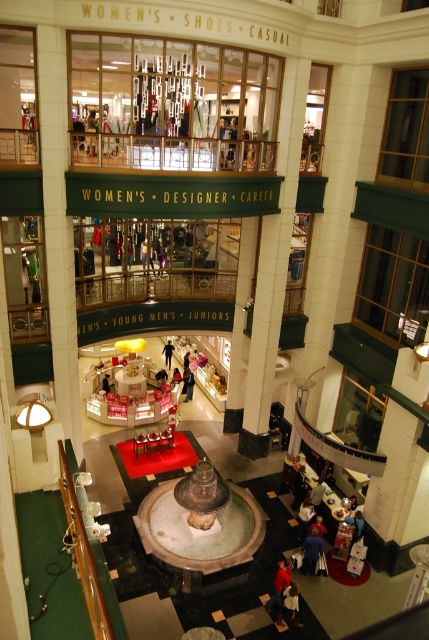
Is dark blue jeans at center in front of white fabric person at center?

No, dark blue jeans at center is further to the viewer.

Who is positioned more to the right, dark blue jeans at center or white fabric person at center?

Positioned to the right is dark blue jeans at center.

Who is more forward, (x=165, y=348) or (x=102, y=384)?

Point (x=102, y=384)

Locate an element on the screen. dark blue jeans at center is located at coordinates (168, 353).

Which is in front, point (308, 570) or point (105, 385)?

Point (308, 570)

Is dark blue jeans at lower right above white fabric person at center?

Incorrect, dark blue jeans at lower right is not positioned above white fabric person at center.

Is point (305, 538) farther from viewer compared to point (109, 387)?

No, (305, 538) is in front of (109, 387).

You are a GUI agent. You are given a task and a screenshot of the screen. Output one action in this format:
    pyautogui.click(x=<x>, y=<y>)
    Task: Click on the dark blue jeans at lower right
    The height and width of the screenshot is (640, 429).
    Given the screenshot: What is the action you would take?
    pyautogui.click(x=311, y=552)

Can you confirm if polished bronze fountain at center is positioned to the right of dark blue jeans at center?

Correct, you'll find polished bronze fountain at center to the right of dark blue jeans at center.

Looking at this image, who is more forward, (x=247, y=502) or (x=166, y=356)?

Positioned in front is point (x=247, y=502).

Between point (235, 550) and point (166, 344), which one is positioned in front?

Point (235, 550)

Locate an element on the screen. The height and width of the screenshot is (640, 429). polished bronze fountain at center is located at coordinates (199, 524).